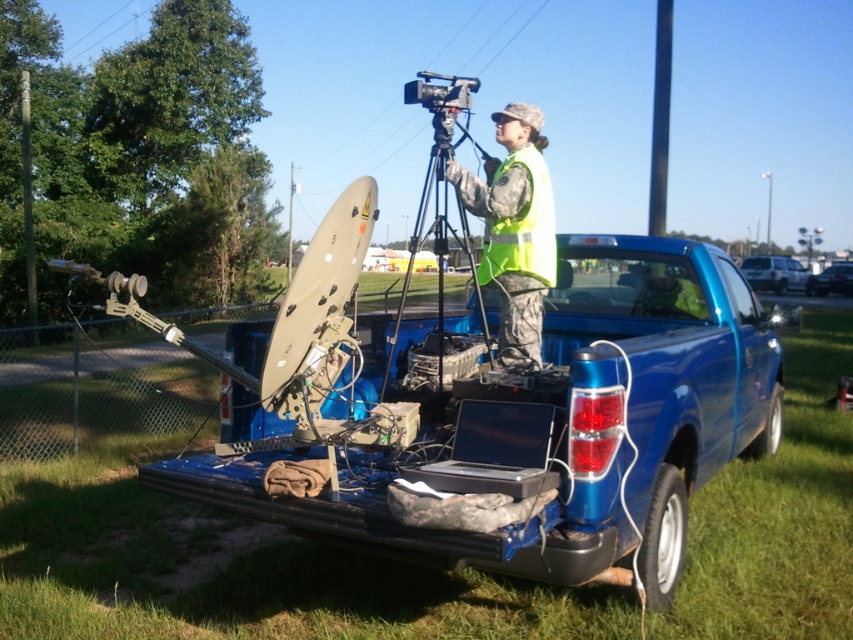
You are a safety inspector checking the equipment layout in the truck bed. You notice two yellow reflective vests. Which one is positioned closer to you, the yellow reflective vest at center or the yellow reflective safety vest at center?

The yellow reflective vest at center is closer to the viewer than the yellow reflective safety vest at center.

You are a technician who needs to locate both the metallic tripod at center and the yellow reflective safety vest at center in the truck bed. From the perspective of someone standing at the front of the truck looking towards the back, which object is on the left side?

The metallic tripod at center is to the left of the yellow reflective safety vest at center, so from the front of the truck, the metallic tripod at center would be on the left side.